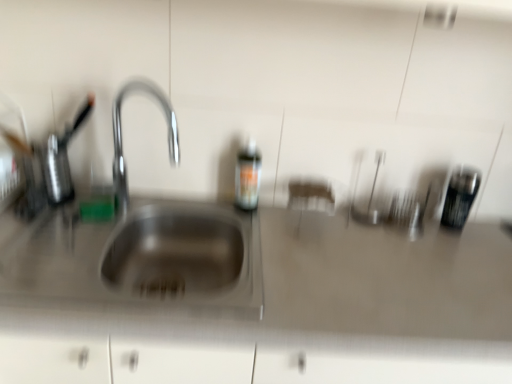
Question: In terms of height, does stainless steel sink at left look taller or shorter compared to metallic black canister at right?

Choices:
 (A) short
 (B) tall

Answer: (B)

Question: Would you say stainless steel sink at left is to the left or to the right of metallic black canister at right in the picture?

Choices:
 (A) right
 (B) left

Answer: (B)

Question: Considering the real-world distances, which object is farthest from the satin steel sink at center?

Choices:
 (A) metallic black canister at right
 (B) translucent plastic bottle at center
 (C) stainless steel sink at left

Answer: (A)

Question: Which is farther from the metallic black canister at right?

Choices:
 (A) translucent plastic bottle at center
 (B) stainless steel sink at left
 (C) satin steel sink at center

Answer: (B)